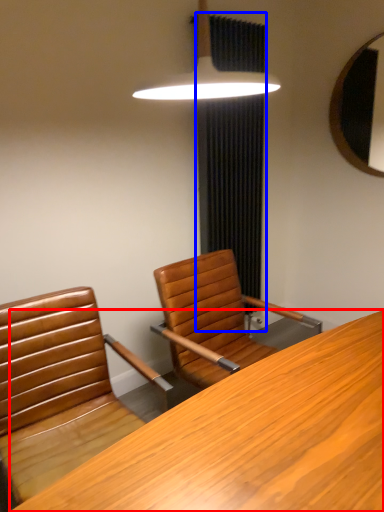
Question: Which point is closer to the camera, desk (highlighted by a red box) or curtain (highlighted by a blue box)?

Choices:
 (A) desk
 (B) curtain

Answer: (A)